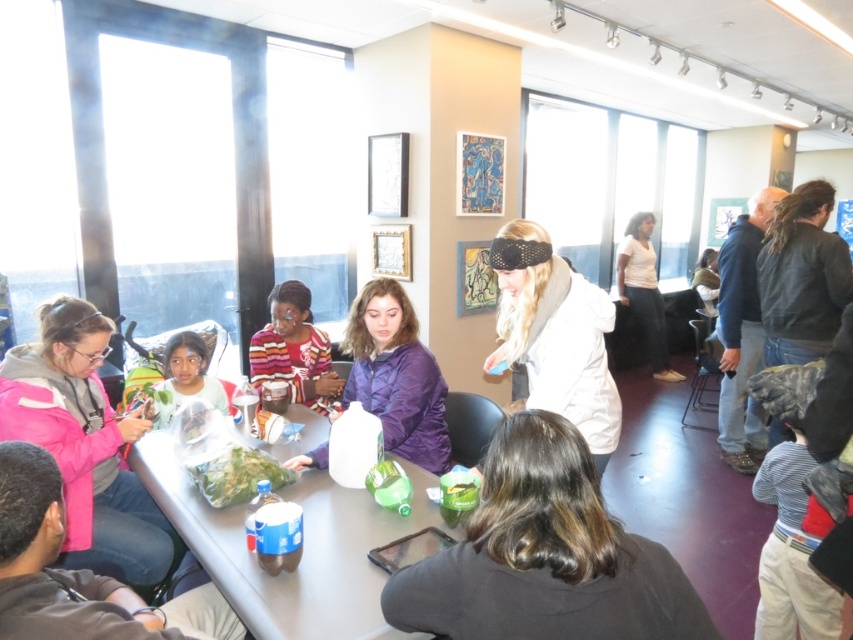
Based on the photo, you are organizing a clothing drive and need to arrange the striped sweater at center and the white cotton shirt at upper right on a shelf. Based on their positions in the image, which item should you place on the left side of the shelf?

The striped sweater at center should be placed on the left side of the shelf since it is to the left of the white cotton shirt at upper right in the image.

You are a tailor trying to decide which garment to alter first. You need to know which garment is narrower between the striped sweater at center and the white cotton shirt at upper right. Which one is narrower?

The striped sweater at center is thinner than the white cotton shirt at upper right, so the striped sweater at center is narrower.